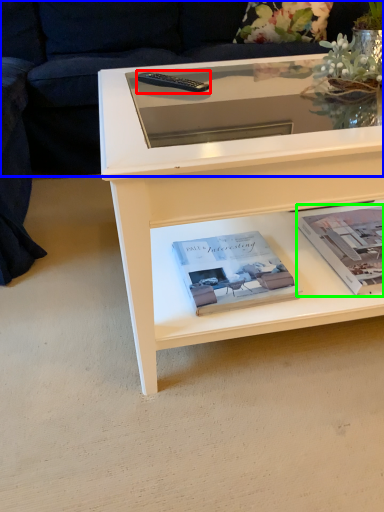
Question: Which object is positioned farthest from remote (highlighted by a red box)? Select from couch (highlighted by a blue box) and paperback book (highlighted by a green box).

Choices:
 (A) couch
 (B) paperback book

Answer: (A)